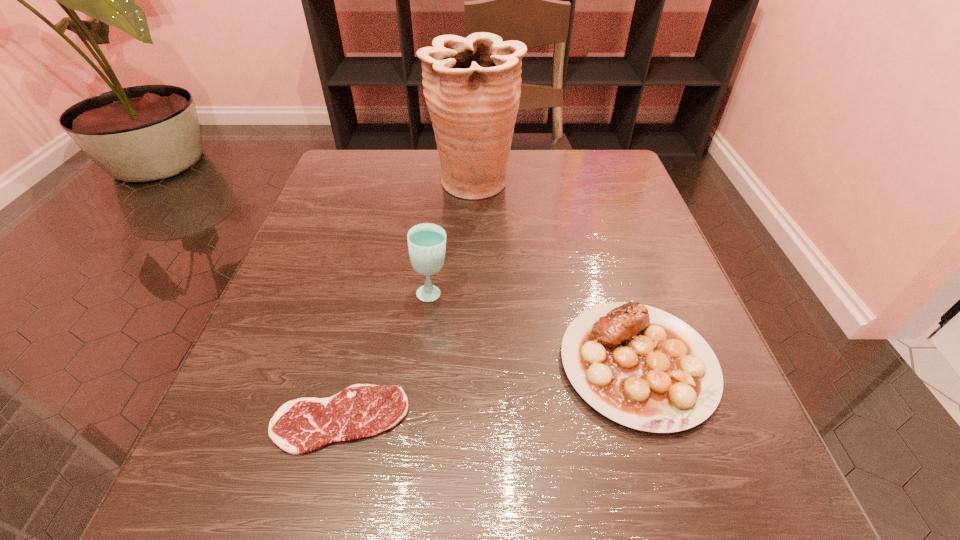
Identify the location of vacant space at the right edge of the desktop. (646, 238).

At what (x,y) coordinates should I click in order to perform the action: click on free space at the far left corner of the desktop. Please return your answer as a coordinate pair (x, y). This screenshot has height=540, width=960. Looking at the image, I should click on (329, 186).

Where is `vacant space at the near left corner`? This screenshot has height=540, width=960. vacant space at the near left corner is located at coordinates (296, 531).

I want to click on free region at the far right corner of the desktop, so click(x=578, y=171).

Locate an element on the screen. vacant area at the near right corner is located at coordinates pos(659,463).

This screenshot has height=540, width=960. Identify the location of free space that is in between the glass and the second shortest object. (535, 328).

Locate an element on the screen. free space between the rightmost object and the shortest object is located at coordinates (489, 392).

This screenshot has height=540, width=960. I want to click on vacant area that lies between the farthest object and the taller steak, so click(x=556, y=274).

Image resolution: width=960 pixels, height=540 pixels. In order to click on blank region between the left steak and the taller steak in this screenshot , I will do `click(489, 392)`.

Where is `blank region between the shorter steak and the third shortest object`? Image resolution: width=960 pixels, height=540 pixels. blank region between the shorter steak and the third shortest object is located at coordinates (386, 356).